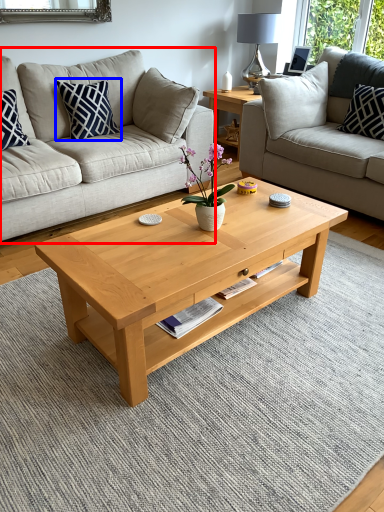
Question: Which object appears farthest to the camera in this image, studio couch (highlighted by a red box) or pillow (highlighted by a blue box)?

Choices:
 (A) studio couch
 (B) pillow

Answer: (B)